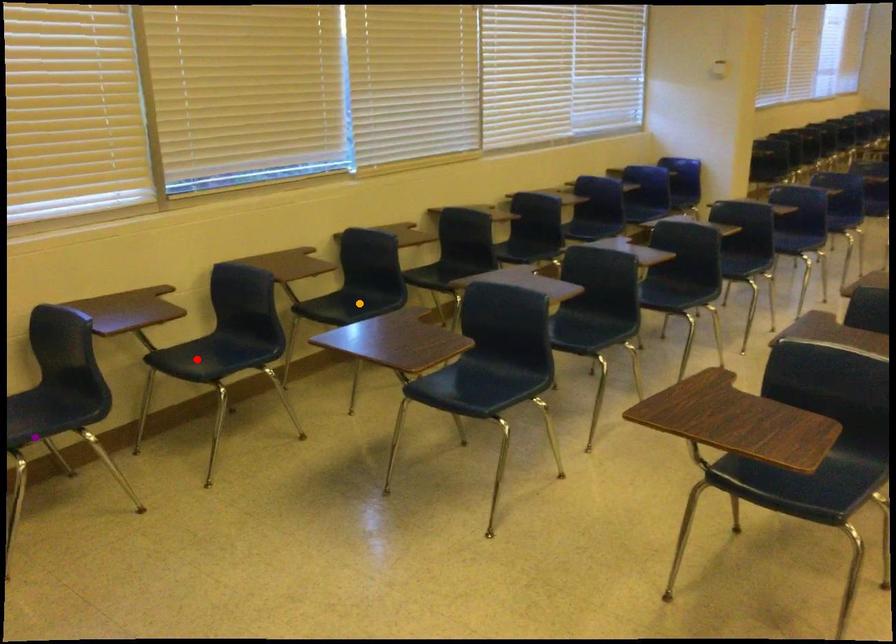
Order these from farthest to nearest:
orange point, red point, purple point

orange point → red point → purple point